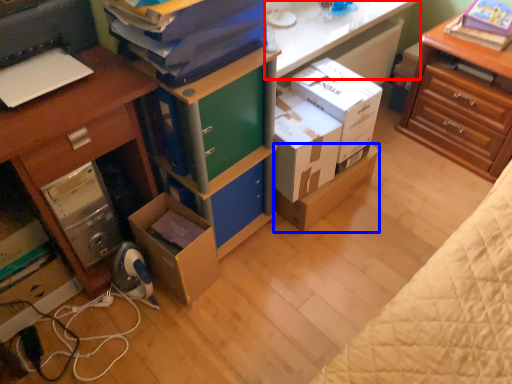
Question: Which point is further to the camera, counter top (highlighted by a red box) or cardboard box (highlighted by a blue box)?

Choices:
 (A) counter top
 (B) cardboard box

Answer: (B)